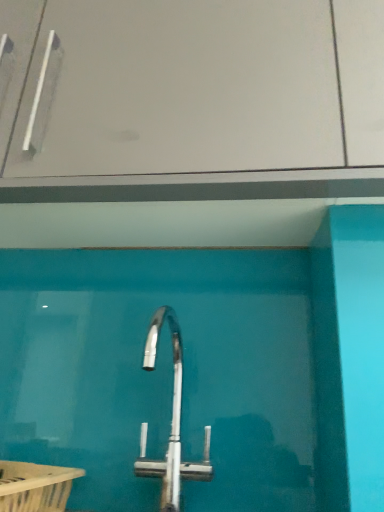
The image size is (384, 512). What do you see at coordinates (171, 423) in the screenshot?
I see `polished chrome tap at center` at bounding box center [171, 423].

You are a GUI agent. You are given a task and a screenshot of the screen. Output one action in this format:
    pyautogui.click(x=<x>, y=<y>)
    Task: Click on the white plastic bath at lower left
    Image resolution: width=384 pixels, height=512 pixels.
    Given the screenshot: What is the action you would take?
    pyautogui.click(x=35, y=486)

From the image's perspective, between transparent glass door at center and polished chrome tap at center, which one is located above?

transparent glass door at center.

Which is behind, point (75, 110) or point (174, 452)?

Point (75, 110)

Looking at this image, is polished chrome tap at center inside transparent glass door at center?

No, transparent glass door at center does not contain polished chrome tap at center.

Could you tell me if transparent glass door at center is facing polished chrome tap at center?

No, transparent glass door at center does not turn towards polished chrome tap at center.

In the scene shown: Can you confirm if white plastic bath at lower left is wider than polished chrome tap at center?

Yes.

Considering the relative positions of white plastic bath at lower left and polished chrome tap at center in the image provided, is white plastic bath at lower left to the left or to the right of polished chrome tap at center?

Based on their positions, white plastic bath at lower left is located to the left of polished chrome tap at center.

Is white plastic bath at lower left further to the viewer compared to polished chrome tap at center?

No, it is in front of polished chrome tap at center.

Can you tell me how much white plastic bath at lower left and polished chrome tap at center differ in facing direction?

2.53 degrees.

In the image, is polished chrome tap at center positioned in front of or behind transparent glass door at center?

Visually, polished chrome tap at center is located in front of transparent glass door at center.

Is polished chrome tap at center not close to transparent glass door at center?

No, polished chrome tap at center is not far away from transparent glass door at center.

Considering the relative sizes of polished chrome tap at center and transparent glass door at center in the image provided, is polished chrome tap at center bigger than transparent glass door at center?

Actually, polished chrome tap at center might be smaller than transparent glass door at center.

Is polished chrome tap at center not inside transparent glass door at center?

polished chrome tap at center lies outside transparent glass door at center's area.

The image size is (384, 512). Identify the location of glass door on the right of white plastic bath at lower left. (207, 87).

Considering the sizes of transparent glass door at center and white plastic bath at lower left in the image, is transparent glass door at center taller or shorter than white plastic bath at lower left?

In the image, transparent glass door at center appears to be taller than white plastic bath at lower left.

Based on their sizes in the image, would you say transparent glass door at center is bigger or smaller than white plastic bath at lower left?

transparent glass door at center is bigger than white plastic bath at lower left.

Looking at this image, from the image's perspective, relative to white plastic bath at lower left, is transparent glass door at center above or below?

transparent glass door at center is above white plastic bath at lower left.

Looking at their sizes, would you say white plastic bath at lower left is wider or thinner than transparent glass door at center?

In the image, white plastic bath at lower left appears to be more narrow than transparent glass door at center.

Between white plastic bath at lower left and transparent glass door at center, which one has smaller size?

white plastic bath at lower left is smaller.

Between white plastic bath at lower left and transparent glass door at center, which one has more height?

transparent glass door at center.

Is white plastic bath at lower left inside the boundaries of transparent glass door at center, or outside?

white plastic bath at lower left is not inside transparent glass door at center, it's outside.

Looking at the image, does polished chrome tap at center seem bigger or smaller compared to white plastic bath at lower left?

Clearly, polished chrome tap at center is larger in size than white plastic bath at lower left.

From the image's perspective, is polished chrome tap at center above or below white plastic bath at lower left?

From the image's perspective, polished chrome tap at center appears above white plastic bath at lower left.

Can you see polished chrome tap at center touching white plastic bath at lower left?

No, polished chrome tap at center is not with white plastic bath at lower left.

Looking at this image, from a real-world perspective, which is physically above, polished chrome tap at center or white plastic bath at lower left?

polished chrome tap at center is physically above.

Where is `tap in front of the transparent glass door at center`? This screenshot has height=512, width=384. tap in front of the transparent glass door at center is located at coordinates (171, 423).

Image resolution: width=384 pixels, height=512 pixels. In order to click on tap that appears behind the white plastic bath at lower left in this screenshot , I will do `click(171, 423)`.

Considering their positions, is transparent glass door at center positioned closer to white plastic bath at lower left than polished chrome tap at center?

polished chrome tap at center lies closer to white plastic bath at lower left than the other object.

Estimate the real-world distances between objects in this image. Which object is further from transparent glass door at center, polished chrome tap at center or white plastic bath at lower left?

white plastic bath at lower left.

From the image, which object appears to be nearer to white plastic bath at lower left, polished chrome tap at center or transparent glass door at center?

polished chrome tap at center is positioned closer to the anchor white plastic bath at lower left.

From the image, which object appears to be farther from polished chrome tap at center, transparent glass door at center or white plastic bath at lower left?

The object further to polished chrome tap at center is transparent glass door at center.

Considering their positions, is white plastic bath at lower left positioned further to polished chrome tap at center than transparent glass door at center?

transparent glass door at center is further to polished chrome tap at center.

From the image, which object appears to be nearer to transparent glass door at center, white plastic bath at lower left or polished chrome tap at center?

polished chrome tap at center is positioned closer to the anchor transparent glass door at center.

Locate an element on the screen. This screenshot has width=384, height=512. tap between transparent glass door at center and white plastic bath at lower left in the up-down direction is located at coordinates (171, 423).